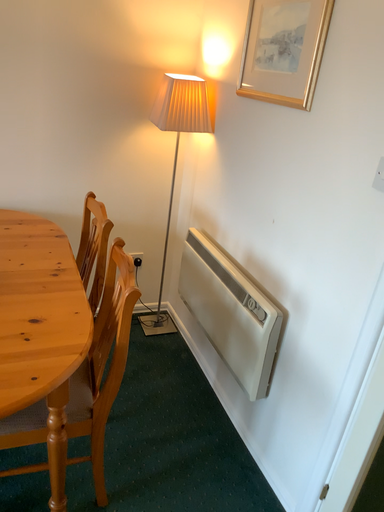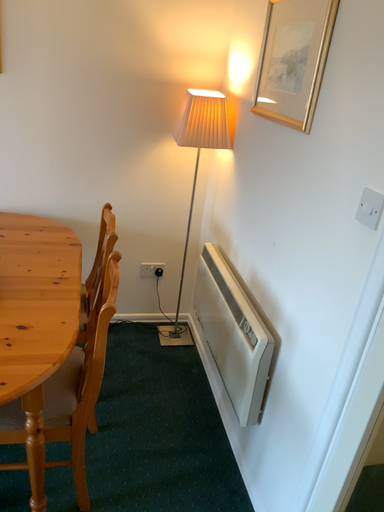
Question: Which way did the camera rotate in the video?

Choices:
 (A) rotated left
 (B) rotated right

Answer: (A)